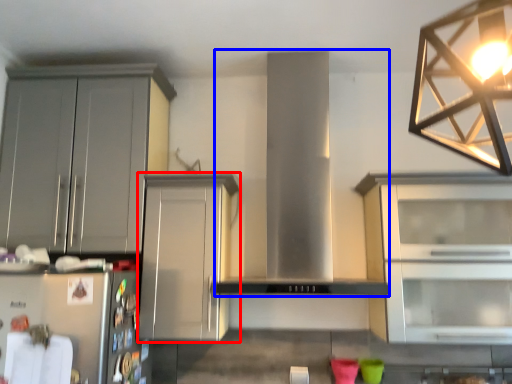
Question: Which point is further to the camera, cabinetry (highlighted by a red box) or hood (highlighted by a blue box)?

Choices:
 (A) cabinetry
 (B) hood

Answer: (A)